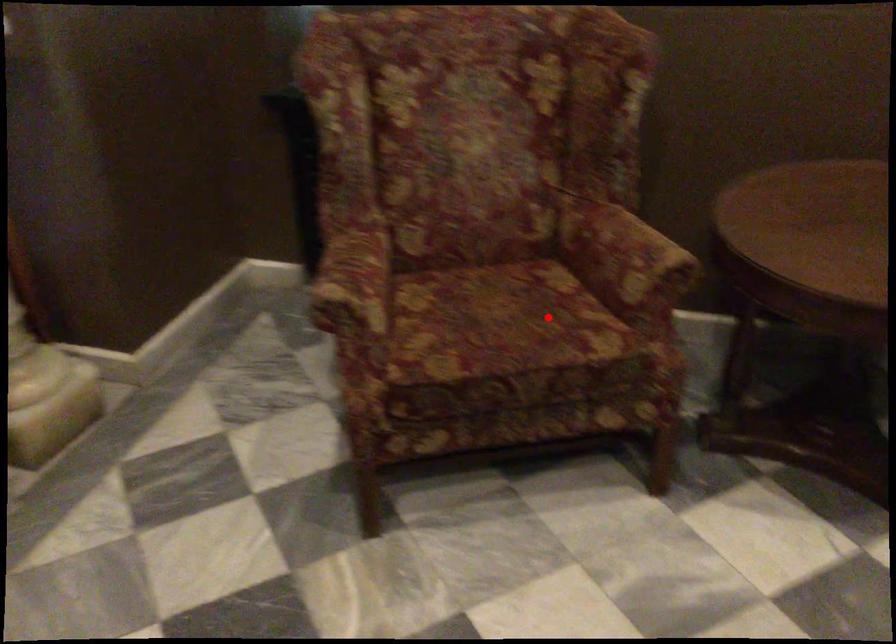
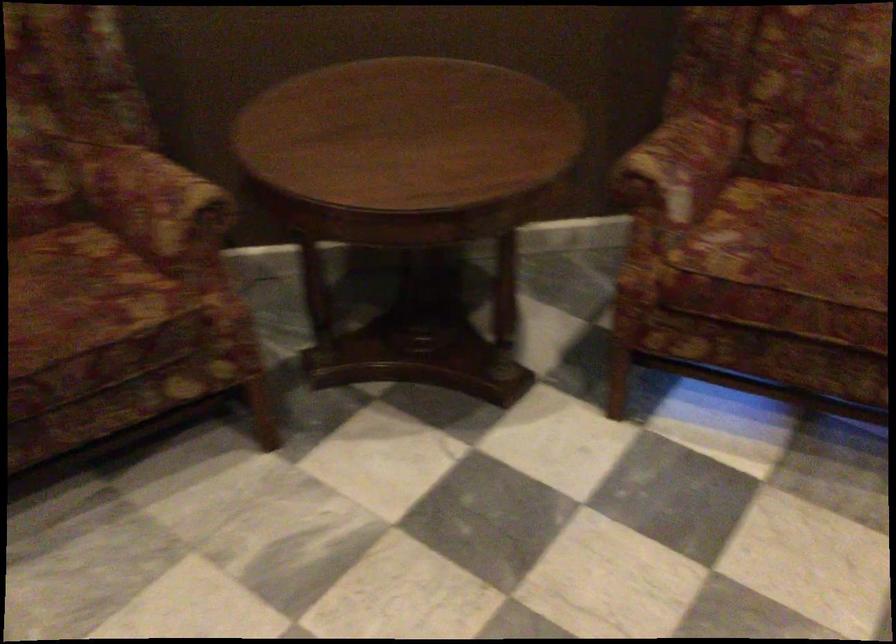
The point at the highlighted location is marked in the first image. Where is the corresponding point in the second image?

(80, 292)